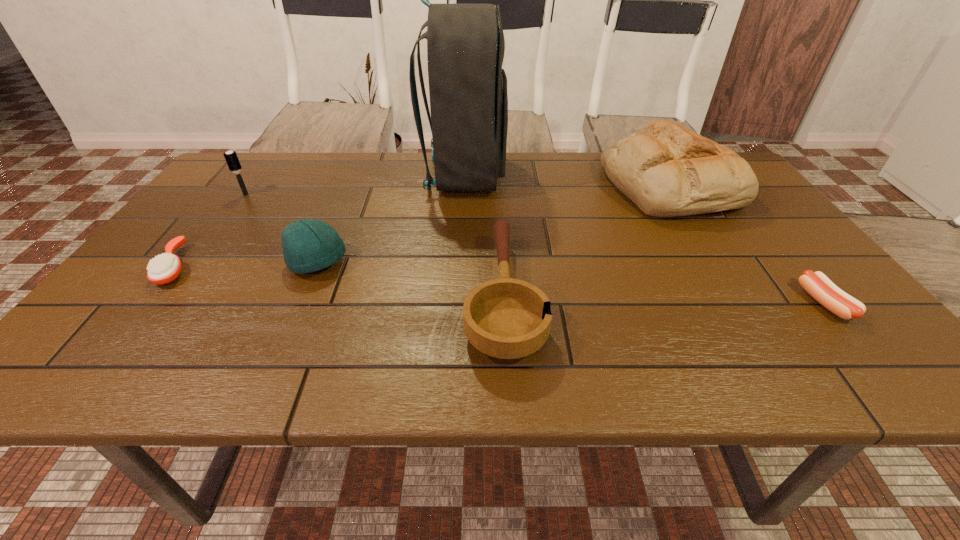
You are a GUI agent. You are given a task and a screenshot of the screen. Output one action in this format:
    pyautogui.click(x=<x>, y=<y>)
    Task: Click on the empty space between the beanie and the shorter hairbrush
    The image size is (960, 540).
    Given the screenshot: What is the action you would take?
    pyautogui.click(x=248, y=265)

Where is `vacant region between the shorter hairbrush and the taller hairbrush`? This screenshot has width=960, height=540. vacant region between the shorter hairbrush and the taller hairbrush is located at coordinates (211, 231).

The width and height of the screenshot is (960, 540). I want to click on blank region between the saucepan and the shorter hairbrush, so point(340,281).

Where is `vacant area that lies between the farther hairbrush and the backpack`? vacant area that lies between the farther hairbrush and the backpack is located at coordinates (355, 185).

Identify the location of vacant region between the fifth tallest object and the shorter hairbrush. The width and height of the screenshot is (960, 540). (340, 281).

Identify the location of vacant space that's between the tallest object and the fourth tallest object. Image resolution: width=960 pixels, height=540 pixels. [x=392, y=219].

Locate an element on the screen. vacant space that's between the third object from left to right and the farther hairbrush is located at coordinates (282, 228).

Select which object is the sixth closest to the sixth shortest object. Please provide its 2D coordinates. Your answer should be formatted as a tuple, i.e. [(x, y)], where the tuple contains the x and y coordinates of a point satisfying the conditions above.

[(164, 268)]

At what (x,y) coordinates should I click in order to perform the action: click on object that is the third closest one to the tallest object. Please return your answer as a coordinate pair (x, y). This screenshot has height=540, width=960. Looking at the image, I should click on (666, 170).

You are a GUI agent. You are given a task and a screenshot of the screen. Output one action in this format:
    pyautogui.click(x=<x>, y=<y>)
    Task: Click on the free space that satisfies the following two spatial constraints: 1. on the front-facing side of the backpack; 2. on the back side of the bread
    The width and height of the screenshot is (960, 540).
    Given the screenshot: What is the action you would take?
    pyautogui.click(x=464, y=186)